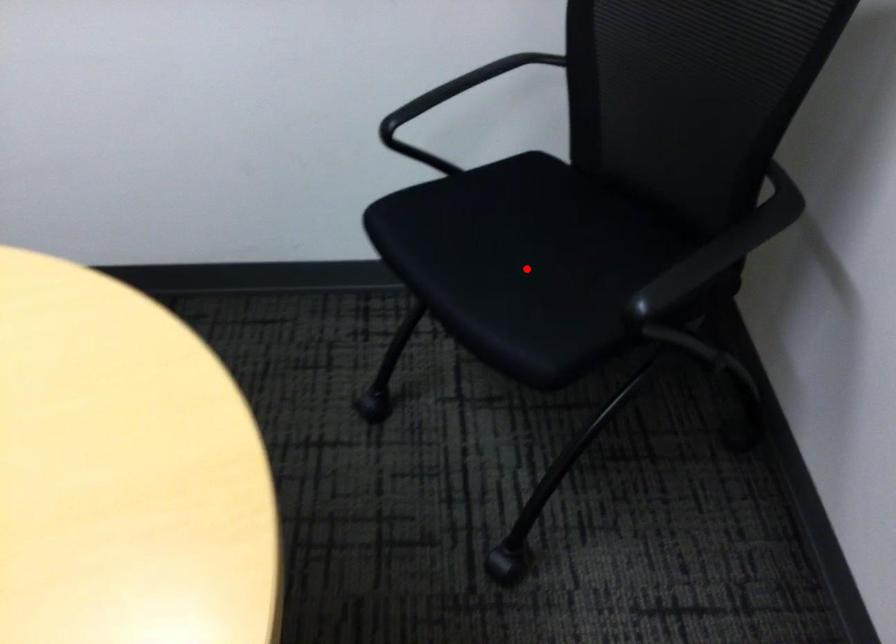
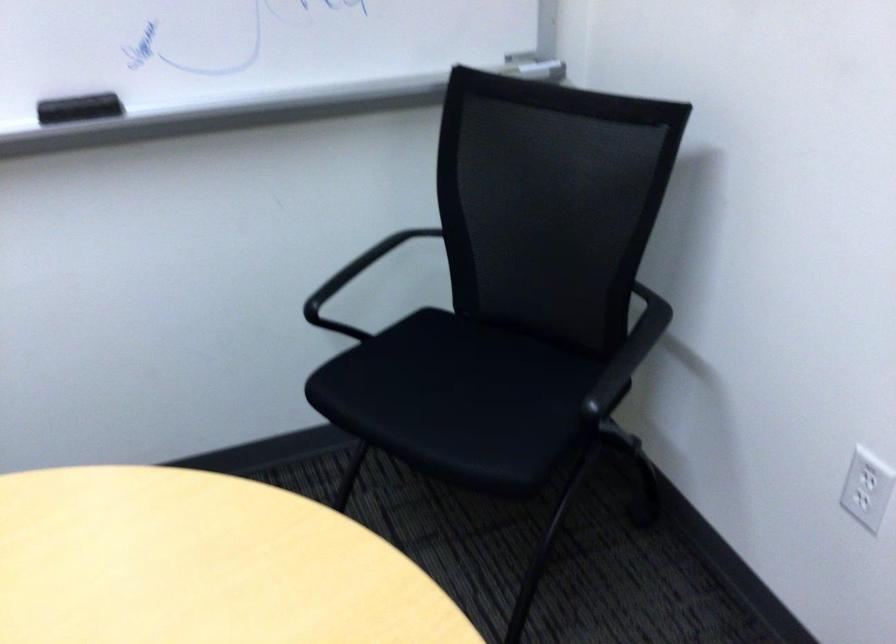
Question: I am providing you with two images of the same scene from different viewpoints. A red point is marked on the first image. At the location where the point appears in image 1, is it still visible in image 2?

Choices:
 (A) Yes
 (B) No

Answer: (A)